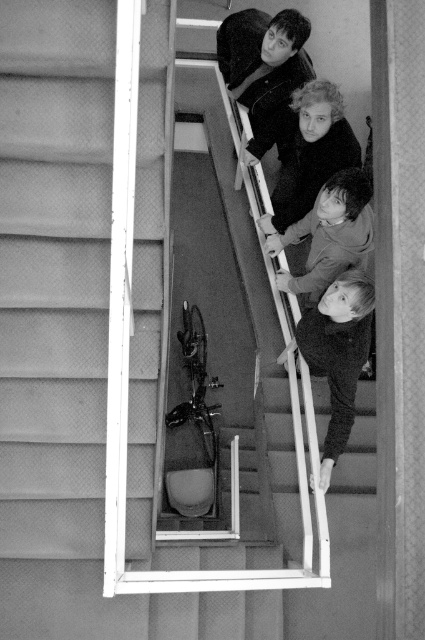
You are a photographer analyzing the image. You need to determine which clothing item has a more slender appearance between the smooth black shirt at lower right and the dark gray sweater at center. Which one would you choose?

The smooth black shirt at lower right is thinner than the dark gray sweater at center, so the smooth black shirt at lower right has a more slender appearance.

You are standing at the bottom of the staircase in the image. The smooth black shirt at upper center is the person you need to hand a document to. Given that you can only throw the document up to 10 feet, can you reach them?

The smooth black shirt at upper center is 11.31 feet away from the camera, which is beyond your throwing range of 10 feet. You cannot reach them by throwing the document.